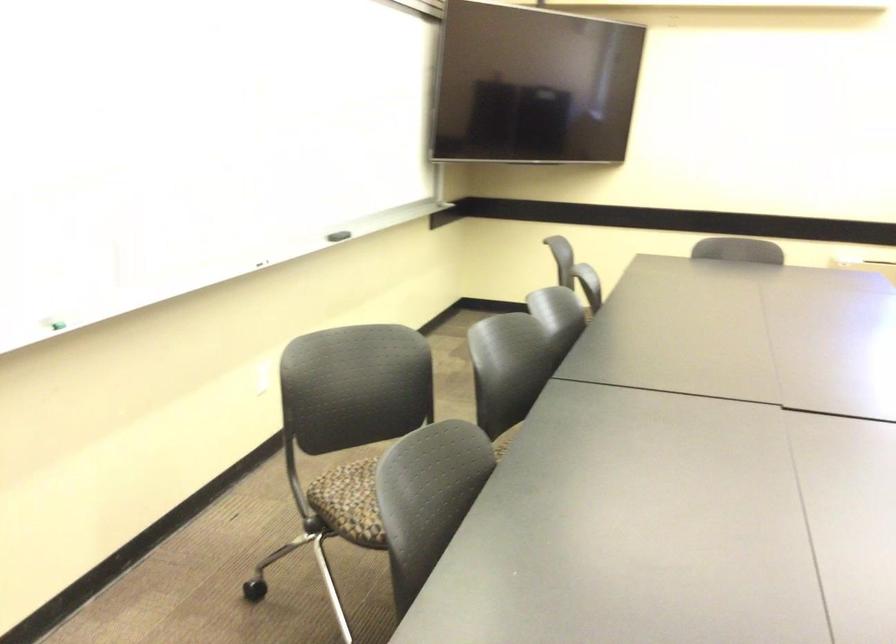
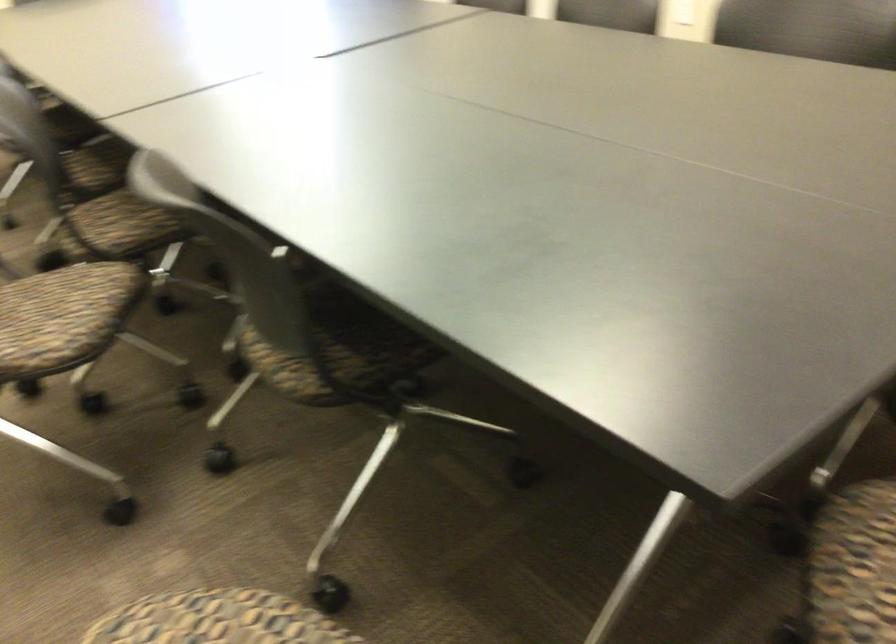
Consider the image. Based on the continuous images, in which direction is the camera rotating?

The rotation direction of the camera is right-down.